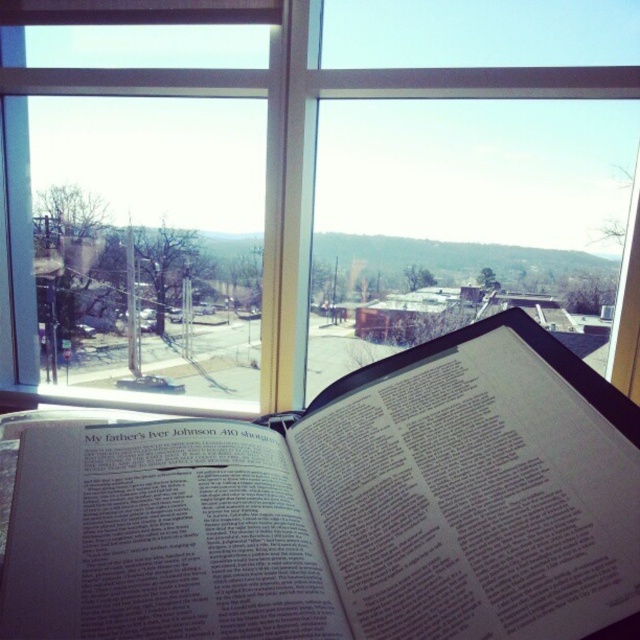
Question: Can you confirm if white paper book at center is thinner than transparent glass window at center?

Choices:
 (A) yes
 (B) no

Answer: (A)

Question: Which point is closer to the camera taking this photo?

Choices:
 (A) (381, 362)
 (B) (10, 77)

Answer: (A)

Question: Where is white paper book at center located in relation to transparent glass window at center in the image?

Choices:
 (A) above
 (B) below

Answer: (B)

Question: Does white paper book at center have a smaller size compared to transparent glass window at center?

Choices:
 (A) yes
 (B) no

Answer: (A)

Question: Which of the following is the farthest from the observer?

Choices:
 (A) (90, 6)
 (B) (468, 602)

Answer: (A)